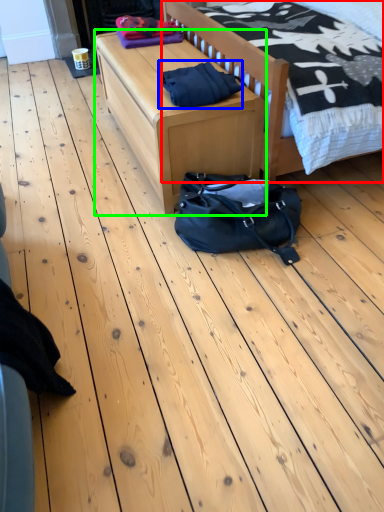
Question: Considering the real-world distances, which object is farthest from bed (highlighted by a red box)? material (highlighted by a blue box) or table (highlighted by a green box)?

Choices:
 (A) material
 (B) table

Answer: (B)